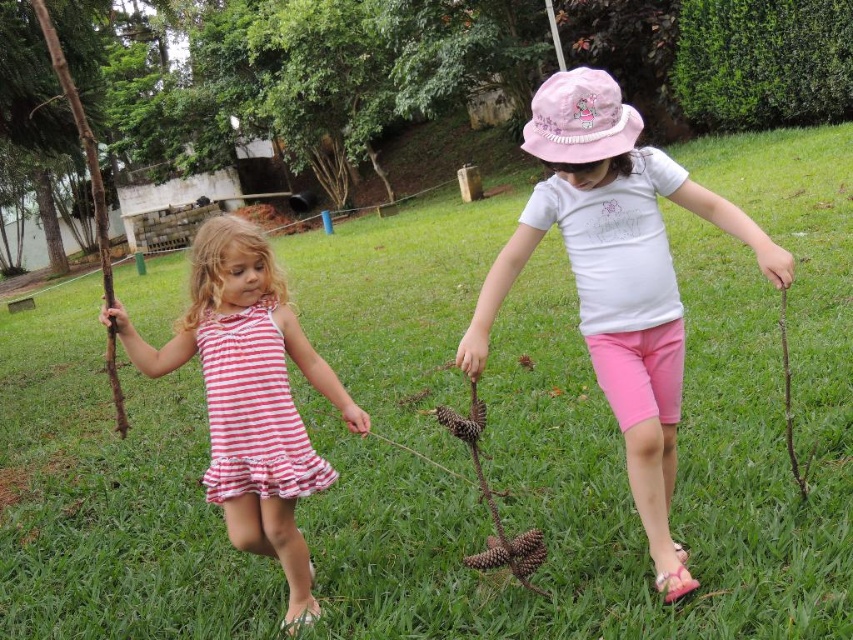
You are a fashion designer who wants to create a new line of childrenswear. You observe the striped fabric dress at left and the brown rough twig at right in the image. Which item is narrower in width?

The striped fabric dress at left is narrower in width than the brown rough twig at right.

You are a photographer who wants to capture a closeup of the striped fabric dress at left. Based on its position coordinates, where should you aim your camera?

The striped fabric dress at left is located at coordinates point 0.619 on the x axis and 0.293 on the y axis, so you should aim your camera at that point to capture a closeup.

You are a photographer trying to capture the perfect shot of the scene. You want to place your camera exactly at the center of the image. If the pink cotton hat at center is located at coordinates 0.434 on the x axis and 0.725 on the y axis, will the hat be centered in your photo?

The pink cotton hat at center is located at coordinates 0.434 on the x axis and 0.725 on the y axis. Since the center of the image would be at coordinates 0.5 on both axes, the hat is slightly to the left and lower than the true center. Therefore, it won